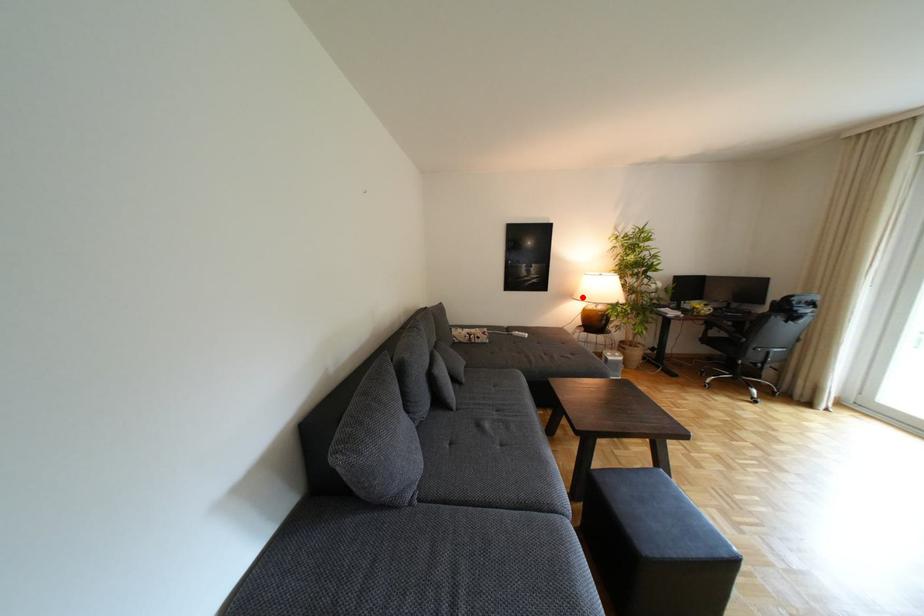
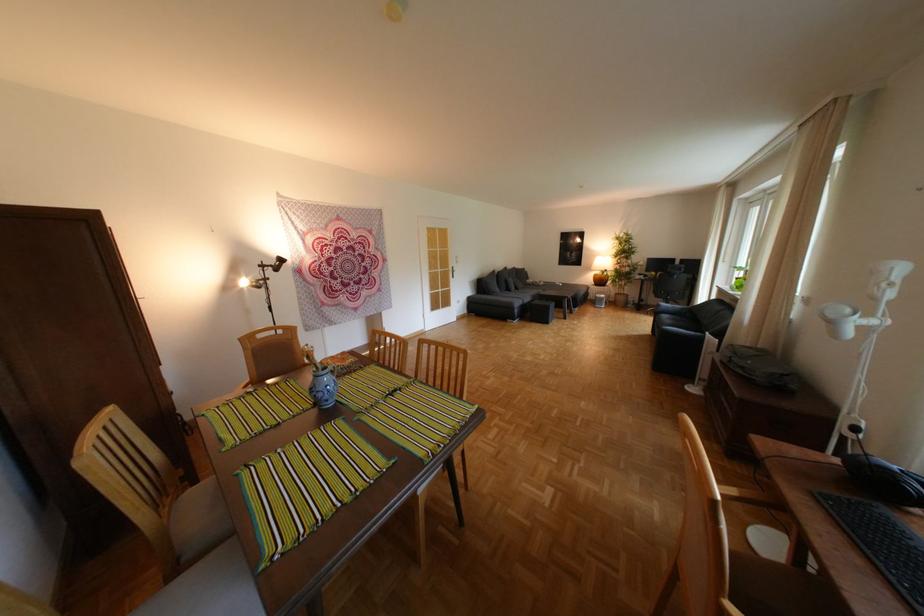
In the second image, find the point that corresponds to the highlighted location in the first image.

(602, 268)